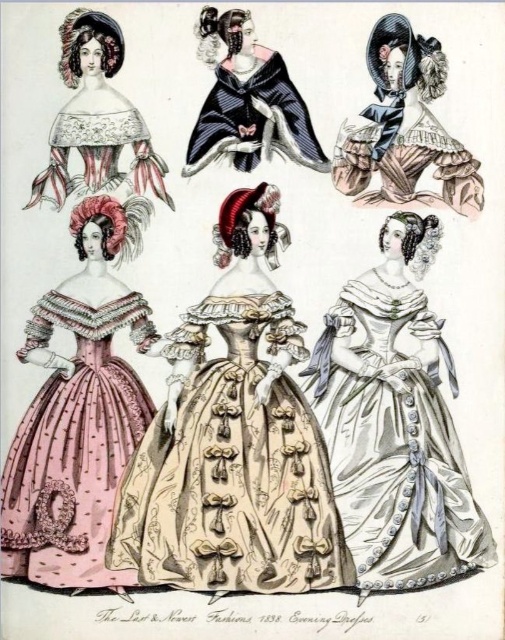
Question: Does beige satin gown at center have a lesser width compared to matte lace capelet at upper left?

Choices:
 (A) yes
 (B) no

Answer: (B)

Question: Is beige satin gown at center positioned before matte black cape at upper right?

Choices:
 (A) no
 (B) yes

Answer: (B)

Question: Which point is closer to the camera?

Choices:
 (A) matte black cape at upper right
 (B) silvery satin gown at center
 (C) beige satin gown at center

Answer: (C)

Question: Among these objects, which one is farthest from the camera?

Choices:
 (A) pink satin dress at left
 (B) matte black cape at upper right
 (C) silvery satin gown at center

Answer: (B)

Question: Does matte black cape at upper right come behind velvet black cape at center?

Choices:
 (A) no
 (B) yes

Answer: (B)

Question: Which of the following is the closest to the observer?

Choices:
 (A) pink satin dress at left
 (B) matte black cape at upper right

Answer: (A)